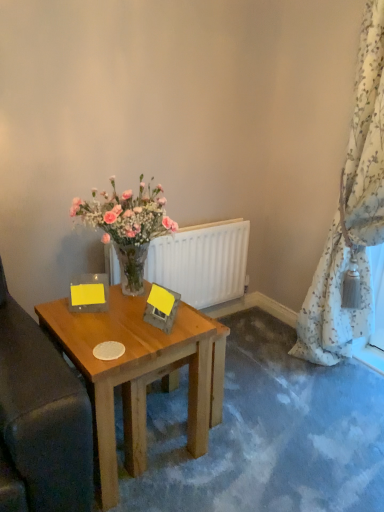
Question: From the image's perspective, is wooden table at center above or below floral-patterned fabric at right?

Choices:
 (A) above
 (B) below

Answer: (B)

Question: In the image, is wooden table at center positioned in front of or behind floral-patterned fabric at right?

Choices:
 (A) front
 (B) behind

Answer: (A)

Question: Which of these objects is positioned farthest from the white matte radiator at center?

Choices:
 (A) wooden table at center
 (B) floral-patterned fabric at right

Answer: (B)

Question: Based on their relative distances, which object is nearer to the white matte radiator at center?

Choices:
 (A) wooden table at center
 (B) floral-patterned fabric at right

Answer: (A)